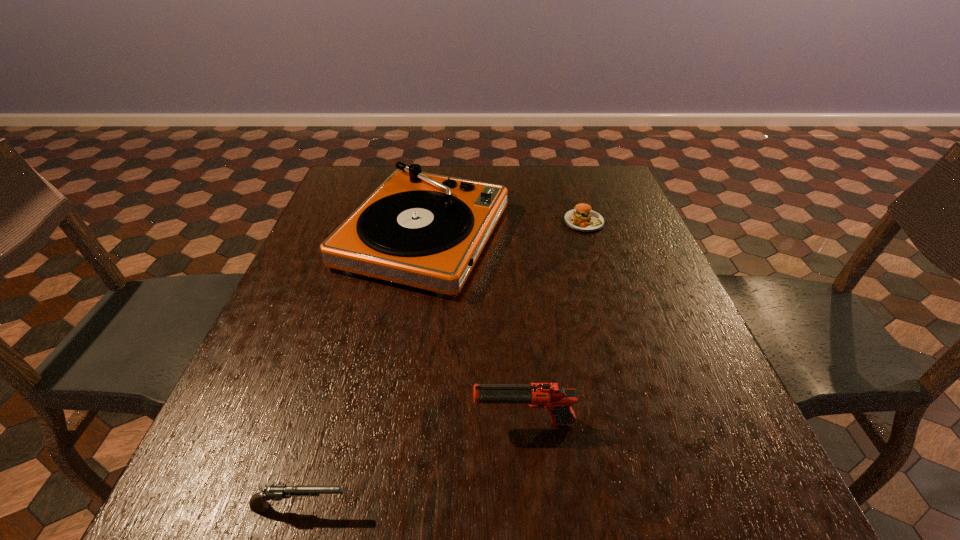
In order to click on record player in this screenshot , I will do `click(423, 230)`.

This screenshot has width=960, height=540. What are the coordinates of `the third farthest object` in the screenshot? It's located at (558, 400).

Locate an element on the screen. the taller gun is located at coordinates (558, 400).

This screenshot has height=540, width=960. Find the location of `the second shortest object`. the second shortest object is located at coordinates (258, 502).

Find the location of a particular element. The width and height of the screenshot is (960, 540). the left gun is located at coordinates (258, 502).

Locate an element on the screen. This screenshot has width=960, height=540. patty is located at coordinates (582, 218).

At what (x,y) coordinates should I click in order to perform the action: click on the rightmost object. Please return your answer as a coordinate pair (x, y). This screenshot has width=960, height=540. Looking at the image, I should click on (582, 218).

Locate an element on the screen. The width and height of the screenshot is (960, 540). vacant position located 0.210m on the front of the record player is located at coordinates (400, 380).

This screenshot has width=960, height=540. I want to click on free region located 0.240m at the aiming end of the taller gun, so click(x=334, y=423).

At what (x,y) coordinates should I click in order to perform the action: click on vacant position located at the aiming end of the taller gun. Please return your answer as a coordinate pair (x, y). This screenshot has height=540, width=960. Looking at the image, I should click on (334, 423).